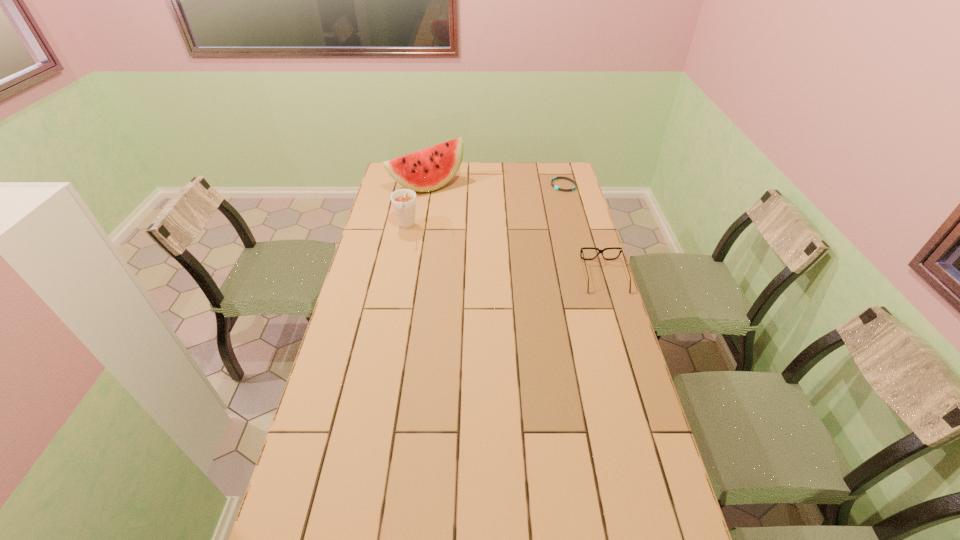
Where is `vacant space that is in between the second nearest object and the wristband`? The width and height of the screenshot is (960, 540). vacant space that is in between the second nearest object and the wristband is located at coordinates click(485, 206).

The image size is (960, 540). I want to click on free space between the root beer and the watermelon, so click(x=417, y=206).

Find the location of a particular element. This screenshot has height=540, width=960. free point between the nearest object and the watermelon is located at coordinates (516, 231).

The height and width of the screenshot is (540, 960). In order to click on empty space that is in between the second nearest object and the shortest object in this screenshot , I will do `click(485, 206)`.

I want to click on free space between the spectacles and the root beer, so click(x=505, y=252).

Select which object is the closest to the third farthest object. Please provide its 2D coordinates. Your answer should be formatted as a tuple, i.e. [(x, y)], where the tuple contains the x and y coordinates of a point satisfying the conditions above.

[(429, 169)]

At what (x,y) coordinates should I click in order to perform the action: click on object that is the closest one to the second shortest object. Please return your answer as a coordinate pair (x, y). This screenshot has width=960, height=540. Looking at the image, I should click on (555, 187).

Identify the location of vacant point that satisfies the following two spatial constraints: 1. on the back side of the watermelon; 2. on the right side of the shortest object. The height and width of the screenshot is (540, 960). (427, 185).